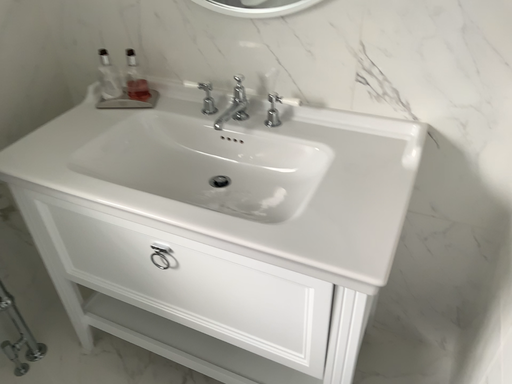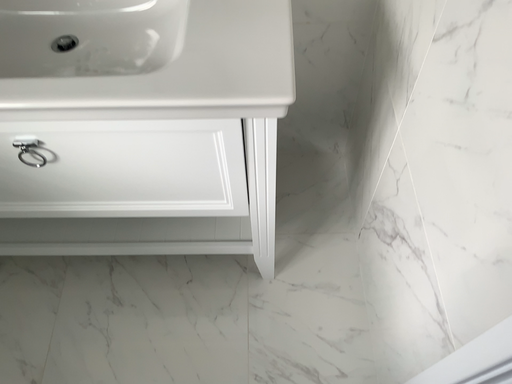
Question: How did the camera likely rotate when shooting the video?

Choices:
 (A) rotated downward
 (B) rotated upward

Answer: (A)